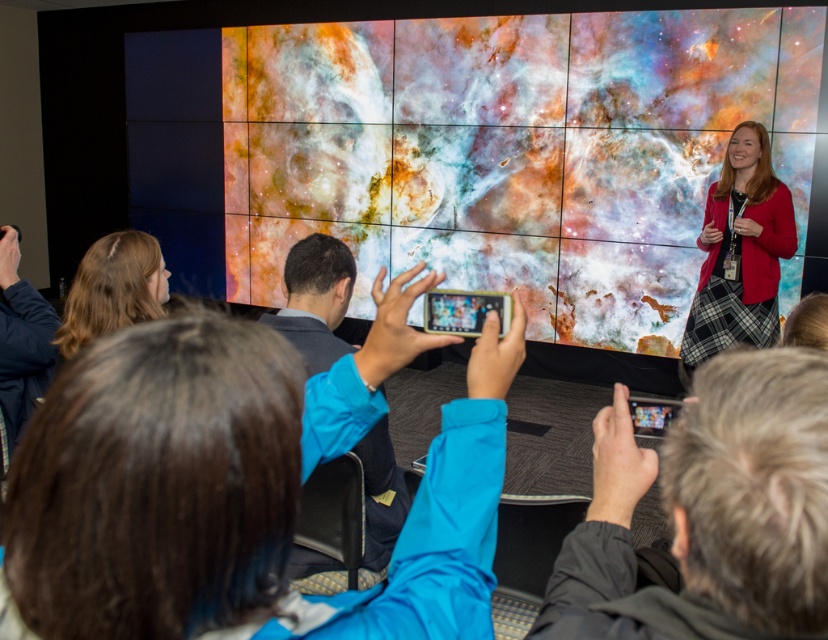
Question: Does multicolored fabric screen at center come in front of matte black tablet at center?

Choices:
 (A) yes
 (B) no

Answer: (B)

Question: Which point is farther to the camera?

Choices:
 (A) plaid skirt at right
 (B) matte black tablet at center
 (C) blonde hair at left

Answer: (A)

Question: Is blonde hair at left thinner than black glossy tablet at upper center?

Choices:
 (A) yes
 (B) no

Answer: (B)

Question: Is blue fabric jacket at center wider than matte black tablet at center?

Choices:
 (A) yes
 (B) no

Answer: (A)

Question: Which object appears closest to the camera in this image?

Choices:
 (A) multicolored fabric screen at center
 (B) blue fabric jacket at center
 (C) matte black tablet at center

Answer: (B)

Question: Which point is closer to the camera?

Choices:
 (A) (147, 237)
 (B) (280, 497)
 (C) (764, 403)

Answer: (B)